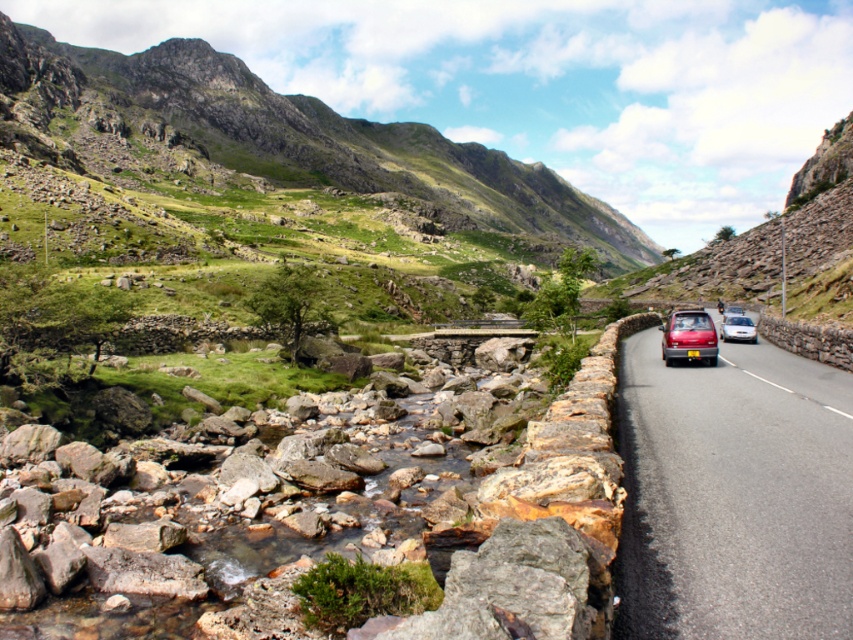
Question: Is shiny metallic car at right below green grassy mountain at upper center?

Choices:
 (A) no
 (B) yes

Answer: (B)

Question: In this image, where is shiny metallic car at right located relative to satin silver sedan at right?

Choices:
 (A) below
 (B) above

Answer: (A)

Question: Which of the following is the farthest from the observer?

Choices:
 (A) (296, 140)
 (B) (698, 339)

Answer: (A)

Question: Which of these objects is positioned closest to the satin silver sedan at right?

Choices:
 (A) shiny metallic car at right
 (B) matte red car at right

Answer: (B)

Question: Based on their relative distances, which object is nearer to the green grassy mountain at upper center?

Choices:
 (A) matte red car at right
 (B) satin silver sedan at right

Answer: (B)

Question: Does green grassy mountain at upper center appear on the right side of satin silver sedan at right?

Choices:
 (A) no
 (B) yes

Answer: (A)